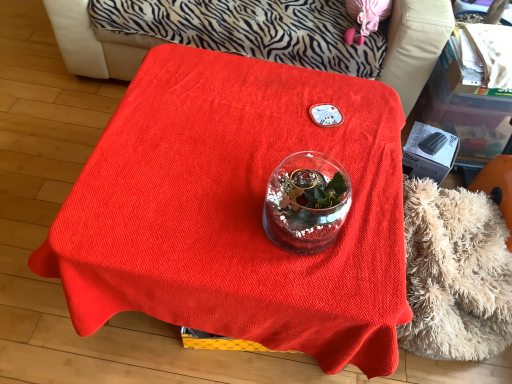
Question: Is smooth red tablecloth at center not near fluffy beige blanket at lower right?

Choices:
 (A) no
 (B) yes

Answer: (B)

Question: Can you confirm if smooth red tablecloth at center is taller than fluffy beige blanket at lower right?

Choices:
 (A) yes
 (B) no

Answer: (A)

Question: From a real-world perspective, is smooth red tablecloth at center on fluffy beige blanket at lower right?

Choices:
 (A) no
 (B) yes

Answer: (B)

Question: Could you tell me if smooth red tablecloth at center is facing fluffy beige blanket at lower right?

Choices:
 (A) yes
 (B) no

Answer: (A)

Question: Is the depth of smooth red tablecloth at center greater than that of fluffy beige blanket at lower right?

Choices:
 (A) yes
 (B) no

Answer: (A)

Question: From a real-world perspective, is smooth red tablecloth at center below fluffy beige blanket at lower right?

Choices:
 (A) no
 (B) yes

Answer: (A)

Question: From a real-world perspective, is fluffy beige blanket at lower right below black plastic box at right?

Choices:
 (A) no
 (B) yes

Answer: (B)

Question: Is fluffy beige blanket at lower right positioned with its back to black plastic box at right?

Choices:
 (A) yes
 (B) no

Answer: (B)

Question: Is fluffy beige blanket at lower right closer to the viewer compared to black plastic box at right?

Choices:
 (A) yes
 (B) no

Answer: (A)

Question: Considering the relative sizes of fluffy beige blanket at lower right and black plastic box at right in the image provided, is fluffy beige blanket at lower right thinner than black plastic box at right?

Choices:
 (A) no
 (B) yes

Answer: (A)

Question: Does fluffy beige blanket at lower right touch black plastic box at right?

Choices:
 (A) no
 (B) yes

Answer: (A)

Question: Can you confirm if fluffy beige blanket at lower right is positioned to the right of black plastic box at right?

Choices:
 (A) no
 (B) yes

Answer: (B)

Question: Is fluffy beige blanket at lower right not inside smooth red tablecloth at center?

Choices:
 (A) no
 (B) yes

Answer: (B)